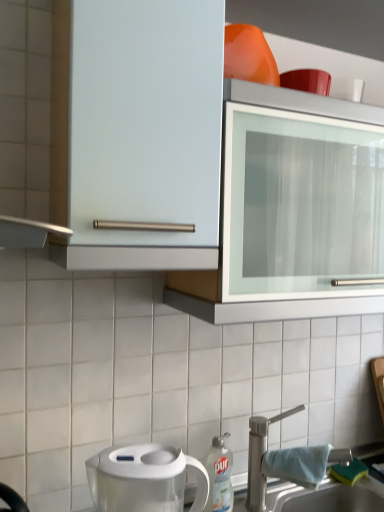
At what (x,y) coordinates should I click in order to perform the action: click on transparent plastic water filter pitcher at lower left. Please return your answer as a coordinate pair (x, y). Looking at the image, I should click on (144, 478).

How different are the orientations of white metallic tap at lower right and transparent plastic water filter pitcher at lower left in degrees?

91.5 degrees.

Is white metallic tap at lower right inside or outside of transparent plastic water filter pitcher at lower left?

The correct answer is: outside.

From the image's perspective, which one is positioned lower, white metallic tap at lower right or transparent plastic water filter pitcher at lower left?

white metallic tap at lower right, from the image's perspective.

Identify the location of kitchen appliance below the white metallic tap at lower right (from a real-world perspective). (219, 475).

From the image's perspective, would you say white metallic tap at lower right is shown under white plastic dish soap bottle at lower center?

Incorrect, from the image's perspective, white metallic tap at lower right is higher than white plastic dish soap bottle at lower center.

Does white metallic tap at lower right have a larger size compared to white plastic dish soap bottle at lower center?

Yes, white metallic tap at lower right is bigger than white plastic dish soap bottle at lower center.

In terms of height, does white metallic tap at lower right look taller or shorter compared to white plastic dish soap bottle at lower center?

white metallic tap at lower right is taller than white plastic dish soap bottle at lower center.

Considering the relative sizes of white ceramic sink at lower right and white metallic tap at lower right in the image provided, is white ceramic sink at lower right shorter than white metallic tap at lower right?

Yes.

Consider the image. Between white ceramic sink at lower right and white metallic tap at lower right, which one has larger size?

white ceramic sink at lower right.

Is white ceramic sink at lower right oriented towards white metallic tap at lower right?

No, white ceramic sink at lower right is not aimed at white metallic tap at lower right.

Between white ceramic sink at lower right and white metallic tap at lower right, which one appears on the right side from the viewer's perspective?

white ceramic sink at lower right.

Is white plastic dish soap bottle at lower center next to transparent plastic water filter pitcher at lower left and touching it?

white plastic dish soap bottle at lower center and transparent plastic water filter pitcher at lower left are not in contact.

Which point is more distant from viewer, (223, 464) or (122, 462)?

The point (223, 464) is behind.

Looking at their sizes, would you say white plastic dish soap bottle at lower center is wider or thinner than transparent plastic water filter pitcher at lower left?

Considering their sizes, white plastic dish soap bottle at lower center looks slimmer than transparent plastic water filter pitcher at lower left.

Does transparent plastic water filter pitcher at lower left have a greater width compared to white metallic tap at lower right?

Yes.

Which of these two, transparent plastic water filter pitcher at lower left or white metallic tap at lower right, stands shorter?

transparent plastic water filter pitcher at lower left.

Would you say transparent plastic water filter pitcher at lower left is inside or outside white metallic tap at lower right?

transparent plastic water filter pitcher at lower left exists outside the volume of white metallic tap at lower right.

Which of these two, transparent plastic water filter pitcher at lower left or white metallic tap at lower right, is smaller?

Smaller between the two is transparent plastic water filter pitcher at lower left.

From the image's perspective, is white plastic dish soap bottle at lower center over white metallic tap at lower right?

No.

Is the surface of white plastic dish soap bottle at lower center in direct contact with white metallic tap at lower right?

No.

Is white plastic dish soap bottle at lower center positioned with its back to white metallic tap at lower right?

white plastic dish soap bottle at lower center is not turned away from white metallic tap at lower right.

Does white plastic dish soap bottle at lower center have a greater height compared to white metallic tap at lower right?

No.

Based on the photo, considering the sizes of objects white plastic dish soap bottle at lower center and white ceramic sink at lower right in the image provided, who is bigger, white plastic dish soap bottle at lower center or white ceramic sink at lower right?

Bigger between the two is white ceramic sink at lower right.

From the image's perspective, is white plastic dish soap bottle at lower center on top of white ceramic sink at lower right?

Yes, from the image's perspective, white plastic dish soap bottle at lower center is above white ceramic sink at lower right.

Is white plastic dish soap bottle at lower center outside of white ceramic sink at lower right?

white plastic dish soap bottle at lower center lies outside white ceramic sink at lower right's area.

Are white plastic dish soap bottle at lower center and white ceramic sink at lower right making contact?

No, white plastic dish soap bottle at lower center is not beside white ceramic sink at lower right.

Locate an element on the screen. Image resolution: width=384 pixels, height=512 pixels. tap behind the transparent plastic water filter pitcher at lower left is located at coordinates (278, 461).

What are the coordinates of `tap to the right of white plastic dish soap bottle at lower center` in the screenshot? It's located at (278, 461).

Considering their positions, is white ceramic sink at lower right positioned further to white plastic dish soap bottle at lower center than transparent plastic water filter pitcher at lower left?

The object further to white plastic dish soap bottle at lower center is white ceramic sink at lower right.

Which object lies further to the anchor point white ceramic sink at lower right, transparent plastic water filter pitcher at lower left or white metallic tap at lower right?

Based on the image, transparent plastic water filter pitcher at lower left appears to be further to white ceramic sink at lower right.

Considering their positions, is white ceramic sink at lower right positioned further to white metallic tap at lower right than white plastic dish soap bottle at lower center?

white plastic dish soap bottle at lower center is further to white metallic tap at lower right.

From the image, which object appears to be farther from white metallic tap at lower right, white plastic dish soap bottle at lower center or white ceramic sink at lower right?

white plastic dish soap bottle at lower center is further to white metallic tap at lower right.

Looking at the image, which one is located closer to white plastic dish soap bottle at lower center, white ceramic sink at lower right or white metallic tap at lower right?

white metallic tap at lower right is closer to white plastic dish soap bottle at lower center.

Estimate the real-world distances between objects in this image. Which object is closer to white metallic tap at lower right, transparent plastic water filter pitcher at lower left or white ceramic sink at lower right?

Based on the image, white ceramic sink at lower right appears to be nearer to white metallic tap at lower right.

Based on their spatial positions, is white ceramic sink at lower right or transparent plastic water filter pitcher at lower left closer to white metallic tap at lower right?

white ceramic sink at lower right.

Consider the image. From the image, which object appears to be farther from white plastic dish soap bottle at lower center, white metallic tap at lower right or white ceramic sink at lower right?

white ceramic sink at lower right lies further to white plastic dish soap bottle at lower center than the other object.

Locate an element on the screen. The width and height of the screenshot is (384, 512). kitchen appliance between transparent plastic water filter pitcher at lower left and white metallic tap at lower right from left to right is located at coordinates (219, 475).

Locate an element on the screen. tap between transparent plastic water filter pitcher at lower left and white ceramic sink at lower right from left to right is located at coordinates (278, 461).

Identify the location of tap situated between white plastic dish soap bottle at lower center and white ceramic sink at lower right from left to right. (278, 461).

At what (x,y) coordinates should I click in order to perform the action: click on kitchen appliance located between transparent plastic water filter pitcher at lower left and white ceramic sink at lower right in the left-right direction. Please return your answer as a coordinate pair (x, y). Image resolution: width=384 pixels, height=512 pixels. Looking at the image, I should click on (219, 475).